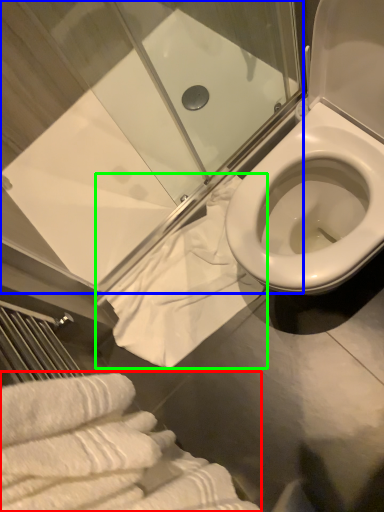
Question: Which is nearer to the bath towel (highlighted by a red box)? shower door (highlighted by a blue box) or bath towel (highlighted by a green box).

Choices:
 (A) shower door
 (B) bath towel

Answer: (B)